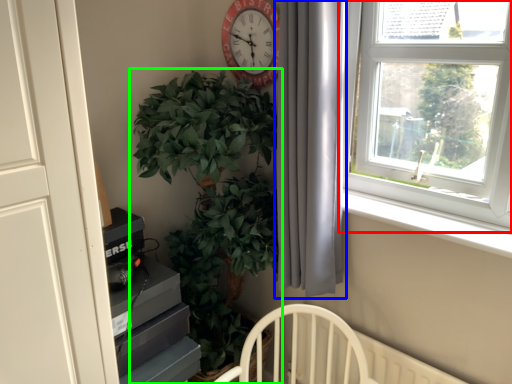
Question: Which object is the closest to the window (highlighted by a red box)? Choose among these: curtain (highlighted by a blue box) or houseplant (highlighted by a green box).

Choices:
 (A) curtain
 (B) houseplant

Answer: (A)